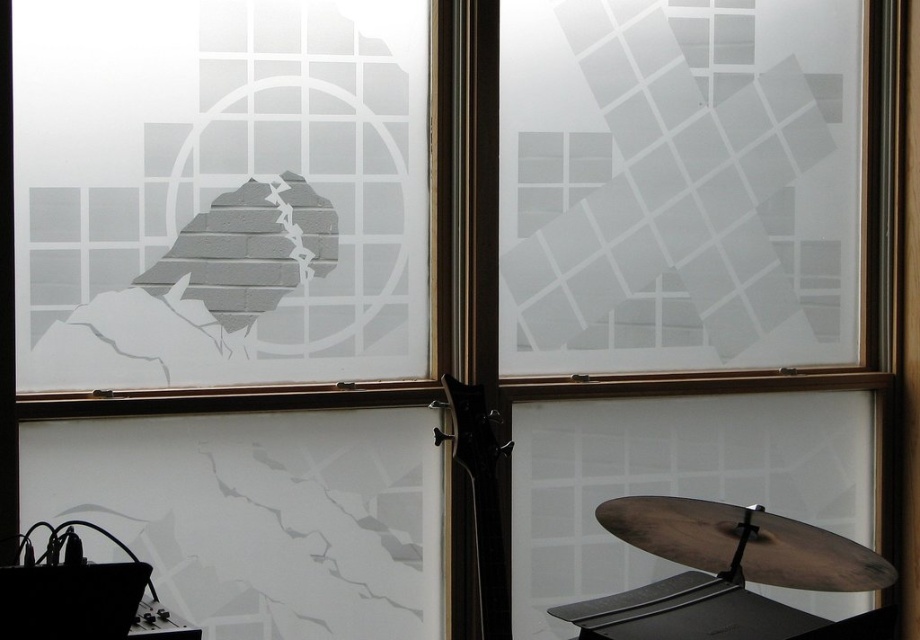
Does frosted glass window at upper left appear on the left side of glossy black guitar at center?

Correct, you'll find frosted glass window at upper left to the left of glossy black guitar at center.

This screenshot has width=920, height=640. I want to click on frosted glass window at upper left, so click(x=220, y=192).

Does point (219, 212) come behind point (479, 540)?

Yes.

Where is `frosted glass window at upper left`? The height and width of the screenshot is (640, 920). frosted glass window at upper left is located at coordinates (220, 192).